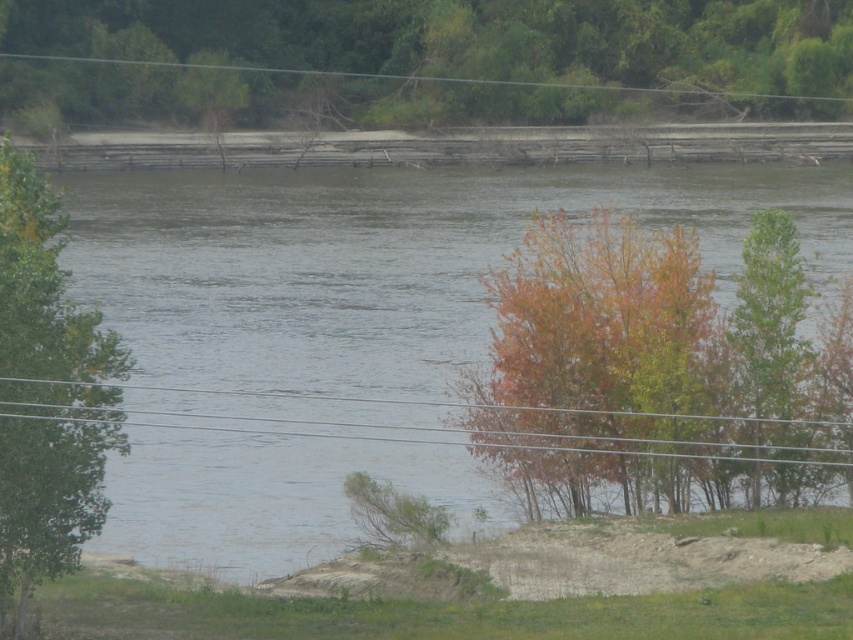
Question: Which object is farther from the camera taking this photo?

Choices:
 (A) green leafy tree at upper center
 (B) green leafy tree at left
 (C) green wire at upper center

Answer: (C)

Question: Which is nearer to the green leafy tree at upper center?

Choices:
 (A) gray water at center
 (B) multicolored foliage at center

Answer: (A)

Question: Among these points, which one is nearest to the camera?

Choices:
 (A) (376, 426)
 (B) (190, 83)
 (C) (793, 408)

Answer: (C)

Question: Can you confirm if multicolored foliage at center is bigger than green wire at upper center?

Choices:
 (A) no
 (B) yes

Answer: (A)

Question: Can you confirm if green leafy tree at left is smaller than green matte tree at right?

Choices:
 (A) yes
 (B) no

Answer: (B)

Question: Can you confirm if gray water at center is positioned to the left of green leafy tree at left?

Choices:
 (A) yes
 (B) no

Answer: (B)